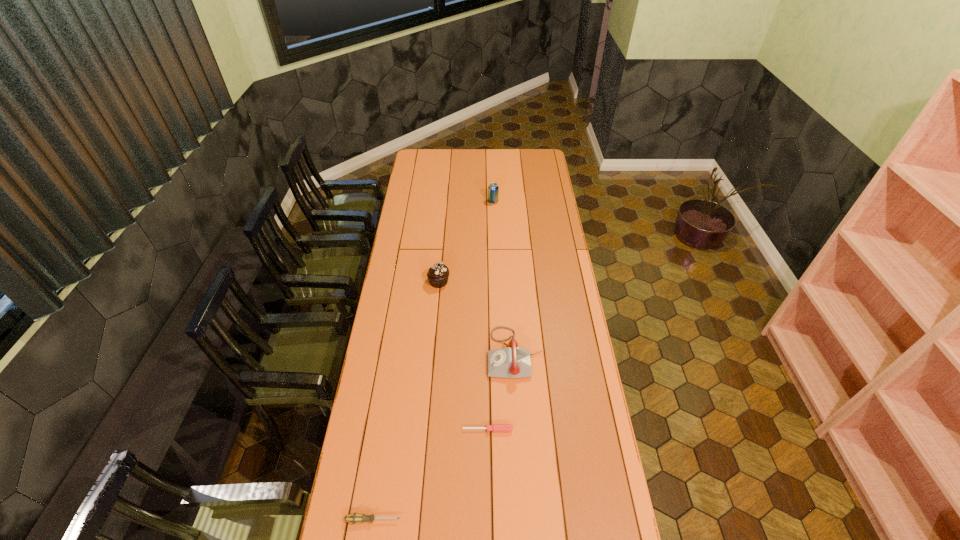
Select which object is the second closest to the beer can. Please provide its 2D coordinates. Your answer should be formatted as a tuple, i.e. [(x, y)], where the tuple contains the x and y coordinates of a point satisfying the conditions above.

[(512, 362)]

At what (x,y) coordinates should I click in order to perform the action: click on vacant region that satisfies the following two spatial constraints: 1. on the back side of the cupcake; 2. on the left side of the farthest object. Please return your answer as a coordinate pair (x, y). Looking at the image, I should click on (446, 201).

This screenshot has width=960, height=540. I want to click on vacant area in the image that satisfies the following two spatial constraints: 1. on the front side of the right screwdriver; 2. at the tip of the left screwdriver, so click(489, 520).